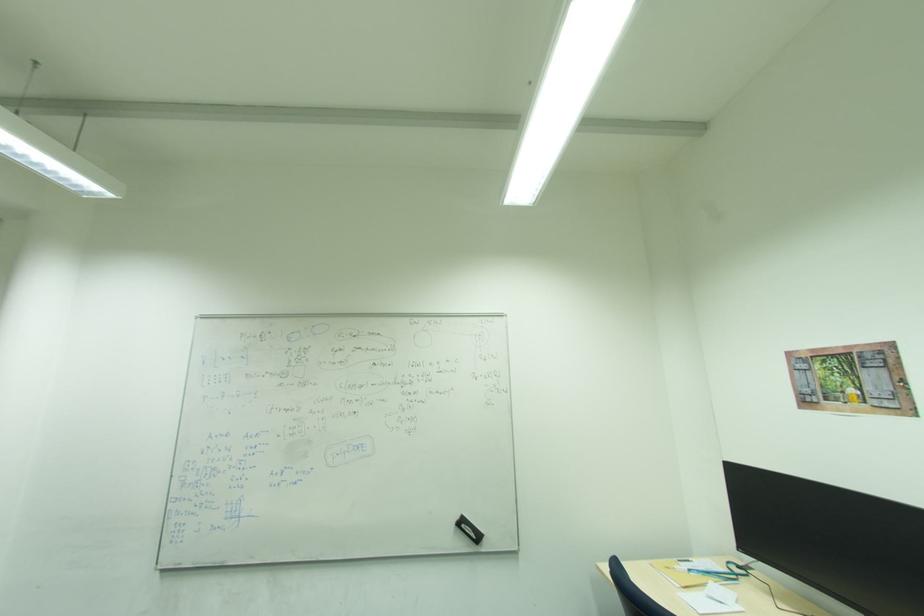
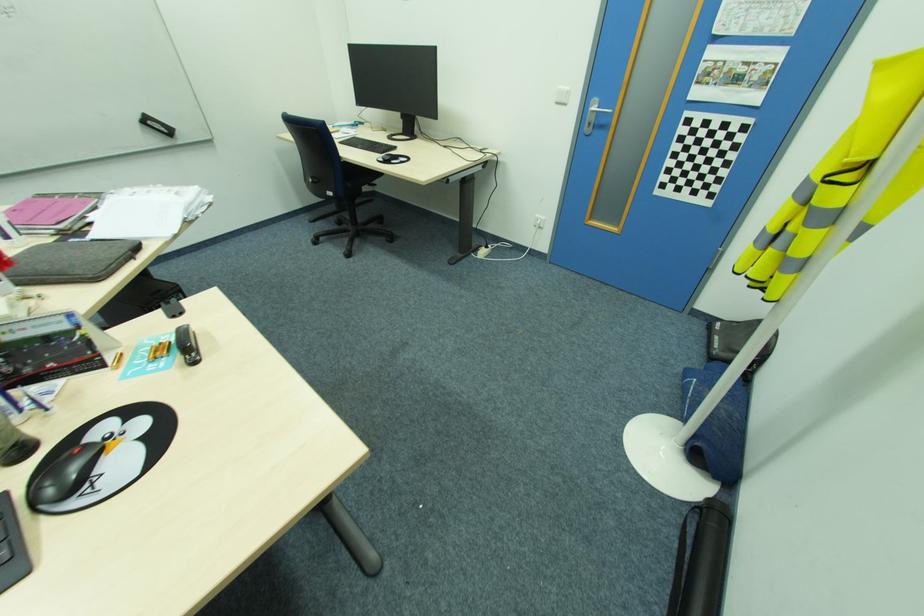
Find the pixel in the second image that matches point (466, 525) in the first image.

(151, 123)